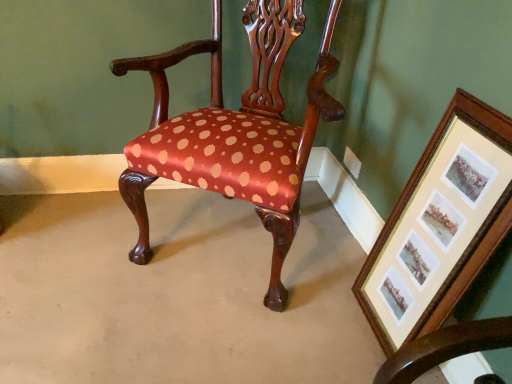
What do you see at coordinates (234, 131) in the screenshot? The height and width of the screenshot is (384, 512). I see `satin fabric chair at center` at bounding box center [234, 131].

Where is `satin fabric chair at center`? The width and height of the screenshot is (512, 384). satin fabric chair at center is located at coordinates (234, 131).

What is the approximate width of wooden framed prints at lower right?

The width of wooden framed prints at lower right is 2.32 inches.

Measure the distance between wooden framed prints at lower right and camera.

wooden framed prints at lower right is 92.33 centimeters from camera.

Find the location of a particular element. Image resolution: width=512 pixels, height=384 pixels. wooden framed prints at lower right is located at coordinates [440, 226].

Describe the element at coordinates (440, 226) in the screenshot. I see `wooden framed prints at lower right` at that location.

You are a GUI agent. You are given a task and a screenshot of the screen. Output one action in this format:
    pyautogui.click(x=<x>, y=<y>)
    Task: Click on the satin fabric chair at center
    
    Given the screenshot: What is the action you would take?
    pyautogui.click(x=234, y=131)

Is wooden framed prints at lower right to the right of satin fabric chair at center from the viewer's perspective?

Correct, you'll find wooden framed prints at lower right to the right of satin fabric chair at center.

Is wooden framed prints at lower right positioned behind satin fabric chair at center?

No, wooden framed prints at lower right is in front of satin fabric chair at center.

Is point (494, 114) positioned before point (211, 170)?

Yes.

From the image's perspective, which object appears higher, wooden framed prints at lower right or satin fabric chair at center?

satin fabric chair at center, from the image's perspective.

From a real-world perspective, which object stands above the other?

In real-world perspective, satin fabric chair at center is above.

Considering the relative sizes of wooden framed prints at lower right and satin fabric chair at center in the image provided, is wooden framed prints at lower right thinner than satin fabric chair at center?

Indeed, wooden framed prints at lower right has a lesser width compared to satin fabric chair at center.

Considering the sizes of objects wooden framed prints at lower right and satin fabric chair at center in the image provided, who is shorter, wooden framed prints at lower right or satin fabric chair at center?

wooden framed prints at lower right is shorter.

Consider the image. Which of these two, wooden framed prints at lower right or satin fabric chair at center, is bigger?

satin fabric chair at center.

Could satin fabric chair at center be considered to be inside wooden framed prints at lower right?

That's incorrect, satin fabric chair at center is not inside wooden framed prints at lower right.

Is wooden framed prints at lower right placed right next to satin fabric chair at center?

No, wooden framed prints at lower right is not touching satin fabric chair at center.

Is wooden framed prints at lower right looking in the opposite direction of satin fabric chair at center?

That's not correct — wooden framed prints at lower right is not looking away from satin fabric chair at center.

What's the angular difference between wooden framed prints at lower right and satin fabric chair at center's facing directions?

The angular difference between wooden framed prints at lower right and satin fabric chair at center is 57.6 degrees.

Measure the distance from wooden framed prints at lower right to satin fabric chair at center.

wooden framed prints at lower right is 19.36 inches from satin fabric chair at center.

Locate an element on the screen. Image resolution: width=512 pixels, height=384 pixels. chair on the left of wooden framed prints at lower right is located at coordinates (234, 131).

Would you say satin fabric chair at center is to the left or to the right of wooden framed prints at lower right in the picture?

In the image, satin fabric chair at center appears on the left side of wooden framed prints at lower right.

Which object is closer to the camera taking this photo, satin fabric chair at center or wooden framed prints at lower right?

wooden framed prints at lower right.

Does point (232, 111) come farther from viewer compared to point (408, 279)?

Yes, point (232, 111) is behind point (408, 279).

From the image's perspective, is satin fabric chair at center beneath wooden framed prints at lower right?

No, from the image's perspective, satin fabric chair at center is not below wooden framed prints at lower right.

From a real-world perspective, is satin fabric chair at center on top of wooden framed prints at lower right?

Yes, from a real-world perspective, satin fabric chair at center is above wooden framed prints at lower right.

Looking at their sizes, would you say satin fabric chair at center is wider or thinner than wooden framed prints at lower right?

satin fabric chair at center is wider than wooden framed prints at lower right.

Who is taller, satin fabric chair at center or wooden framed prints at lower right?

With more height is satin fabric chair at center.

Is satin fabric chair at center smaller than wooden framed prints at lower right?

No.

Is satin fabric chair at center spatially inside wooden framed prints at lower right, or outside of it?

The correct answer is: outside.

Is satin fabric chair at center next to wooden framed prints at lower right and touching it?

There is a gap between satin fabric chair at center and wooden framed prints at lower right.

Is satin fabric chair at center oriented away from wooden framed prints at lower right?

satin fabric chair at center is not turned away from wooden framed prints at lower right.

How different are the orientations of satin fabric chair at center and wooden framed prints at lower right in degrees?

There is a 57.6-degree angle between the facing directions of satin fabric chair at center and wooden framed prints at lower right.

Locate an element on the screen. chair above the wooden framed prints at lower right (from a real-world perspective) is located at coordinates (234, 131).

This screenshot has height=384, width=512. I want to click on picture frame that is below the satin fabric chair at center (from the image's perspective), so click(440, 226).

The image size is (512, 384). I want to click on chair that is above the wooden framed prints at lower right (from the image's perspective), so click(234, 131).